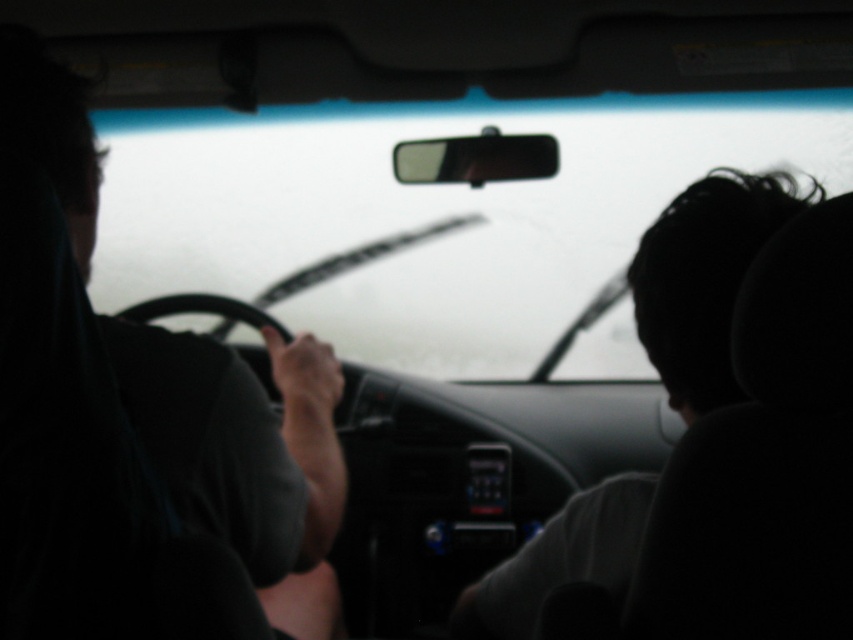
You are a passenger in the car and want to see the dark matte shirt at left. Can you see it through the transparent glass windshield at center?

The dark matte shirt at left is behind the transparent glass windshield at center, so yes, you can see it through the transparent glass windshield at center.

You are sitting in the backseat of a car and notice the transparent glass windshield at center and the dark hair at right. Which object is closer to your eyes?

The dark hair at right is closer to your eyes because the transparent glass windshield at center is further away.

From the picture: You are sitting in the car and want to check the weather outside. Which object, the transparent glass windshield at center or the dark matte shirt at left, would allow you to see the raindrops on the windshield better?

The transparent glass windshield at center has a greater height compared to the dark matte shirt at left, so the transparent glass windshield at center would allow you to see the raindrops better since it is taller and provides a clearer view.